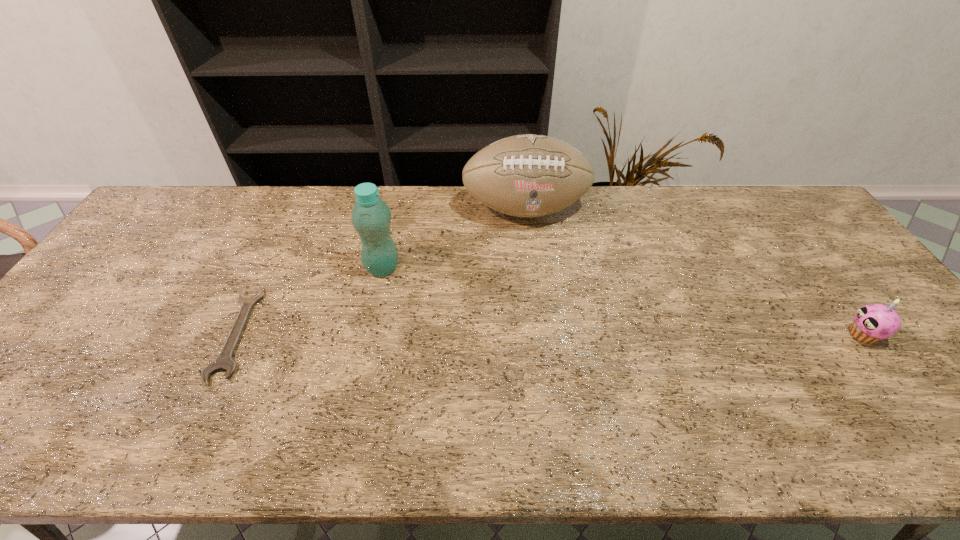
Locate an element on the screen. The height and width of the screenshot is (540, 960). free spot on the desktop that is between the shortest object and the third tallest object and is positioned at the front cap of the third object from right to left is located at coordinates (503, 334).

This screenshot has width=960, height=540. I want to click on vacant space on the desktop that is between the leftmost object and the second shortest object and is positioned on the laces of the football (American), so click(x=552, y=334).